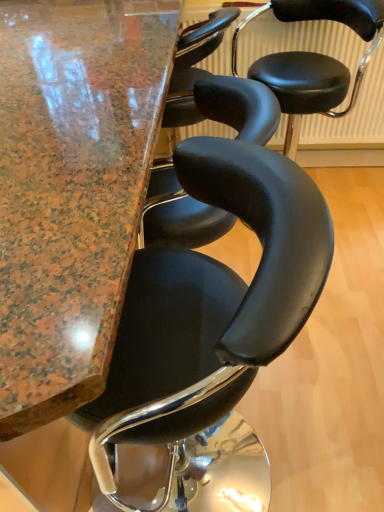
Question: Considering the relative positions of marble table at center and black leather stool at center, which is counted as the 2th chair, starting from the bottom, in the image provided, is marble table at center to the left of black leather stool at center, which is counted as the 2th chair, starting from the bottom, from the viewer's perspective?

Choices:
 (A) yes
 (B) no

Answer: (A)

Question: Are marble table at center and black leather stool at center, arranged as the first chair when viewed from the back, located far from each other?

Choices:
 (A) yes
 (B) no

Answer: (B)

Question: From the image's perspective, is marble table at center located above black leather stool at center, which is counted as the 2th chair, starting from the bottom?

Choices:
 (A) no
 (B) yes

Answer: (A)

Question: Is marble table at center aimed at black leather stool at center, which is counted as the 2th chair, starting from the bottom?

Choices:
 (A) yes
 (B) no

Answer: (B)

Question: Does marble table at center come behind black leather stool at center, marked as the 2th chair in a front-to-back arrangement?

Choices:
 (A) yes
 (B) no

Answer: (B)

Question: Is marble table at center not within black leather stool at center, placed as the first chair when sorted from top to bottom?

Choices:
 (A) no
 (B) yes

Answer: (B)

Question: Does black leather chair at center, which is the 1th chair in front-to-back order, appear on the left side of marble table at center?

Choices:
 (A) no
 (B) yes

Answer: (A)

Question: Is black leather chair at center, positioned as the second chair in back-to-front order, further to camera compared to marble table at center?

Choices:
 (A) yes
 (B) no

Answer: (A)

Question: Considering the relative sizes of black leather chair at center, which is counted as the 1th chair, starting from the bottom, and marble table at center in the image provided, is black leather chair at center, which is counted as the 1th chair, starting from the bottom, bigger than marble table at center?

Choices:
 (A) yes
 (B) no

Answer: (B)

Question: From the image's perspective, is black leather chair at center, which is counted as the 1th chair, starting from the bottom, beneath marble table at center?

Choices:
 (A) no
 (B) yes

Answer: (B)

Question: From a real-world perspective, is black leather chair at center, positioned as the second chair in back-to-front order, positioned under marble table at center based on gravity?

Choices:
 (A) yes
 (B) no

Answer: (B)

Question: Considering the relative sizes of black leather chair at center, which is the 1th chair in front-to-back order, and marble table at center in the image provided, is black leather chair at center, which is the 1th chair in front-to-back order, shorter than marble table at center?

Choices:
 (A) yes
 (B) no

Answer: (A)

Question: Is black leather stool at center, placed as the first chair when sorted from top to bottom, further to the viewer compared to marble table at center?

Choices:
 (A) no
 (B) yes

Answer: (B)